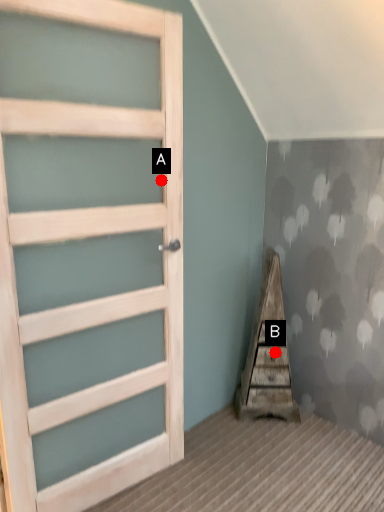
Question: Two points are circled on the image, labeled by A and B beside each circle. Which point is closer to the camera?

Choices:
 (A) A is closer
 (B) B is closer

Answer: (A)